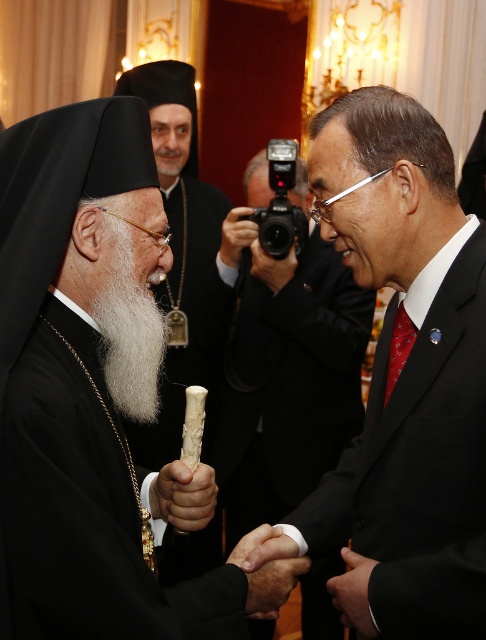
You are an event planner arranging seating for a ceremony. You have two items to place on a narrow table that can only accommodate one of them. The items are the smooth black suit at center and the white fluffy beard at center. Based on their sizes, which item should you choose to fit on the table?

The smooth black suit at center has a larger width than the white fluffy beard at center. Therefore, the white fluffy beard at center would fit better on the narrow table since it is narrower.

You are an artist trying to draw the scene. You need to decide the order to draw the objects based on their height. Which object should you draw first, the smooth black suit at center or the white fluffy beard at center?

The smooth black suit at center has a greater height compared to the white fluffy beard at center, so you should draw the smooth black suit at center first because it is taller.

You are an observer at the ceremony. You notice the smooth black suit at center and the white fluffy beard at center. Which object is positioned lower in the image?

The smooth black suit at center is positioned below the white fluffy beard at center, so it is lower in the image.